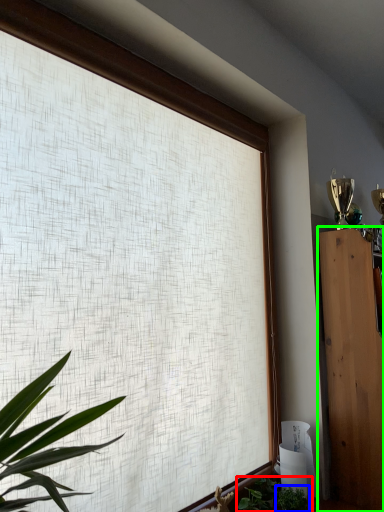
Question: Based on their relative distances, which object is farther from houseplant (highlighted by a red box)? Choose from plant (highlighted by a blue box) and furniture (highlighted by a green box).

Choices:
 (A) plant
 (B) furniture

Answer: (B)